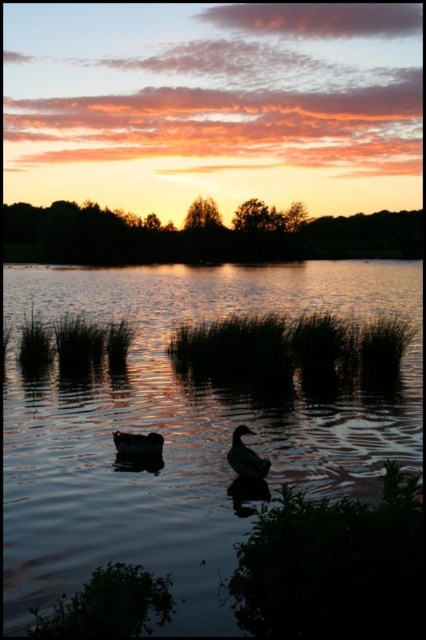
You are a photographer trying to capture the sunset reflection on the lake. You notice the smooth water at center and the dark matte duck at center. Which object would allow you to see the sunset reflection more clearly?

The smooth water at center is bigger than the dark matte duck at center, so the smooth water at center would allow you to see the sunset reflection more clearly because it has a larger surface area to reflect the sunset.

You are an observer standing at the lakeside. You see the smooth water at center and the silvery glossy duck at center. Which object is nearer to you?

The smooth water at center is closer to the viewer than the silvery glossy duck at center.